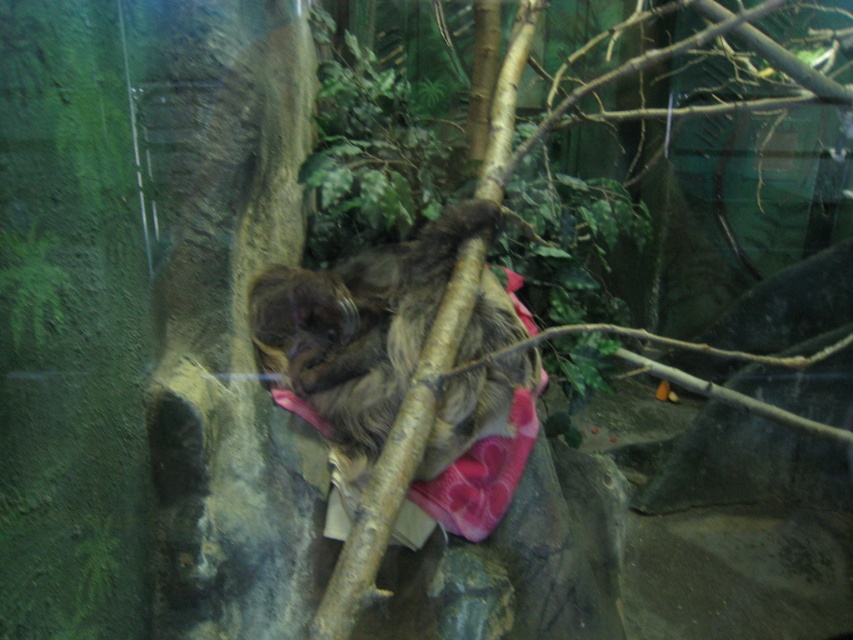
Question: Among these objects, which one is farthest from the camera?

Choices:
 (A) brown fuzzy sloth at center
 (B) brown furry tree at center

Answer: (A)

Question: Can you confirm if brown fuzzy sloth at center is thinner than brown furry tree at center?

Choices:
 (A) yes
 (B) no

Answer: (A)

Question: Is brown fuzzy sloth at center smaller than brown furry tree at center?

Choices:
 (A) yes
 (B) no

Answer: (A)

Question: Is brown fuzzy sloth at center thinner than brown furry tree at center?

Choices:
 (A) no
 (B) yes

Answer: (B)